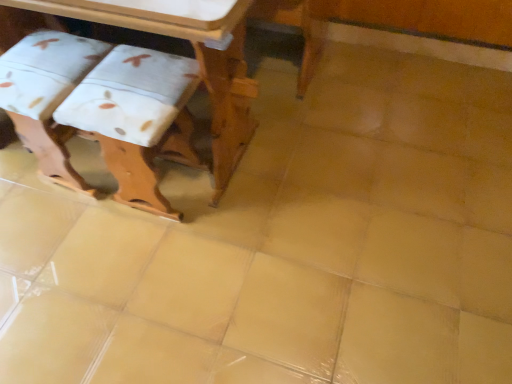
The image size is (512, 384). Identify the location of vacant area that lies in front of wooden table at upper left. (127, 286).